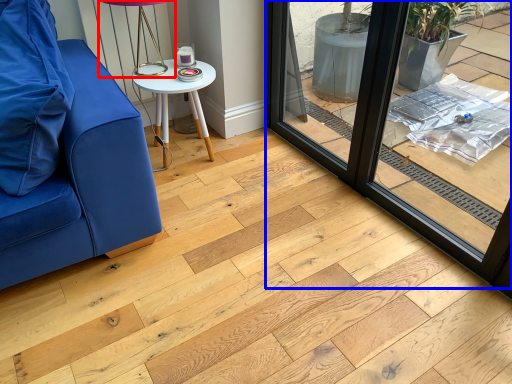
Question: Which object appears closest to the camera in this image, table lamp (highlighted by a red box) or window frame (highlighted by a blue box)?

Choices:
 (A) table lamp
 (B) window frame

Answer: (B)